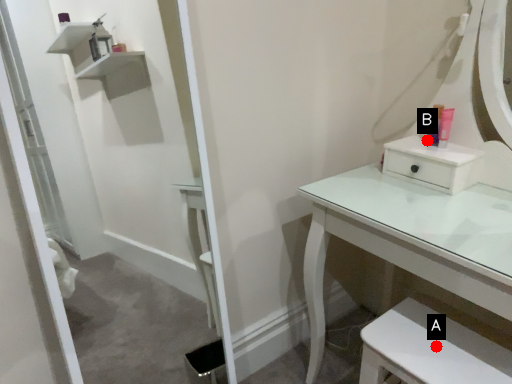
Question: Two points are circled on the image, labeled by A and B beside each circle. Which point is closer to the camera?

Choices:
 (A) A is closer
 (B) B is closer

Answer: (A)